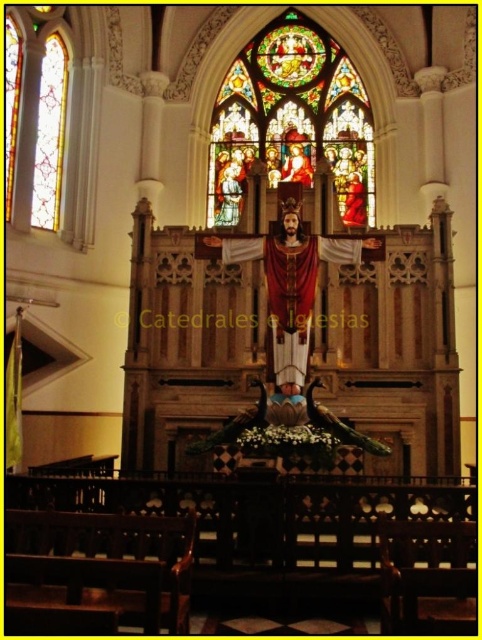
Question: Does stained glass at upper center come behind stained glass window at left?

Choices:
 (A) no
 (B) yes

Answer: (B)

Question: Which object appears farthest from the camera in this image?

Choices:
 (A) stained glass window at left
 (B) stained glass at upper center

Answer: (B)

Question: Does stained glass at upper center have a larger size compared to stained glass window at left?

Choices:
 (A) no
 (B) yes

Answer: (B)

Question: Can you confirm if stained glass at upper center is positioned above stained glass window at left?

Choices:
 (A) no
 (B) yes

Answer: (B)